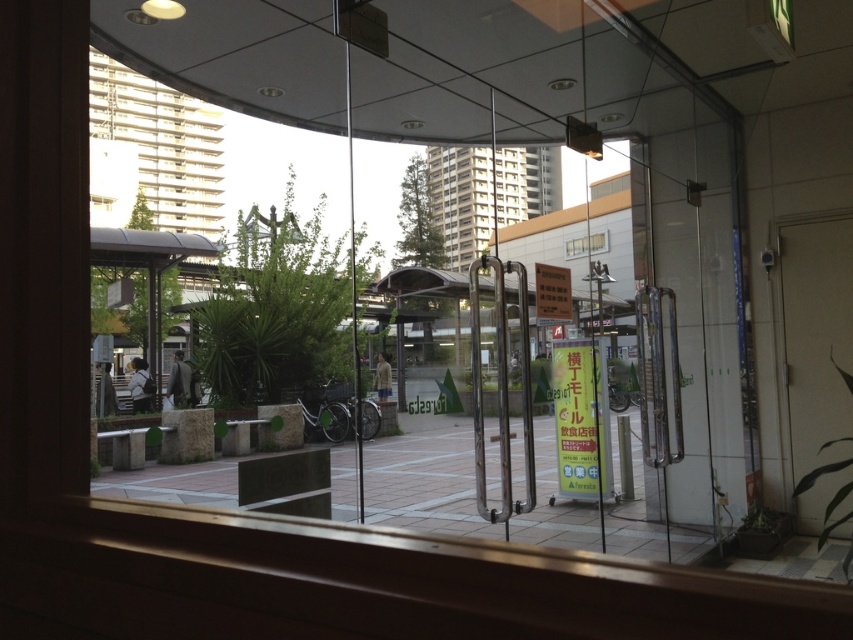
You are standing inside the building and want to look out through the windows. Which window, the transparent glass window at upper left or the clear glass window at center, is positioned higher up?

The transparent glass window at upper left is located above the clear glass window at center, so it is positioned higher up.

You are standing inside the building and looking through the glass door. You notice two windows, the transparent glass window at upper left and the clear glass window at center. Which window is closer to you?

The transparent glass window at upper left is closer to you because it is in front of the clear glass window at center.